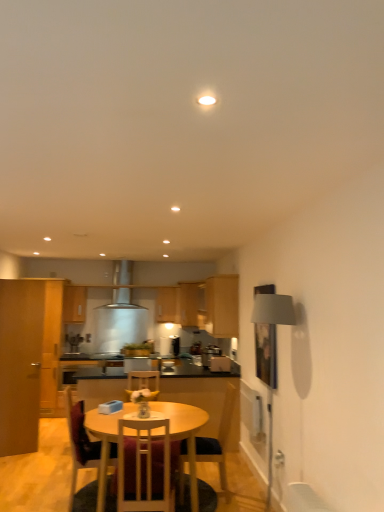
Question: From the image's perspective, is wooden chair at center, which is counted as the 2th chair, starting from the back, located above wooden round table at center?

Choices:
 (A) no
 (B) yes

Answer: (B)

Question: Does wooden chair at center, which ranks as the 3th chair in front-to-back order, lie in front of wooden round table at center?

Choices:
 (A) no
 (B) yes

Answer: (A)

Question: Is wooden chair at center, which is counted as the 2th chair, starting from the back, further to camera compared to wooden round table at center?

Choices:
 (A) yes
 (B) no

Answer: (A)

Question: Is wooden chair at center, which ranks as the 3th chair in front-to-back order, oriented away from wooden round table at center?

Choices:
 (A) no
 (B) yes

Answer: (B)

Question: Is wooden chair at center, which ranks as the 3th chair in front-to-back order, outside wooden round table at center?

Choices:
 (A) no
 (B) yes

Answer: (A)

Question: Is point (112, 416) positioned closer to the camera than point (177, 347)?

Choices:
 (A) closer
 (B) farther

Answer: (A)

Question: In terms of width, does wooden round table at center look wider or thinner when compared to satin black toaster at center, arranged as the 3th appliance when viewed from the front?

Choices:
 (A) thin
 (B) wide

Answer: (B)

Question: Based on their positions, is wooden round table at center located to the left or right of satin black toaster at center, arranged as the 3th appliance when viewed from the front?

Choices:
 (A) left
 (B) right

Answer: (A)

Question: From the image's perspective, relative to satin black toaster at center, placed as the 1th appliance when sorted from left to right, is wooden round table at center above or below?

Choices:
 (A) below
 (B) above

Answer: (A)

Question: Is matte wood cabinet at upper center, the 4th cabinetry when ordered from left to right, to the left or to the right of wooden chair at lower center, marked as the 2th chair in a front-to-back arrangement, in the image?

Choices:
 (A) left
 (B) right

Answer: (B)

Question: Would you say matte wood cabinet at upper center, which is the second cabinetry from right to left, is inside or outside wooden chair at lower center, marked as the 2th chair in a front-to-back arrangement?

Choices:
 (A) outside
 (B) inside

Answer: (A)

Question: Considering their positions, is matte wood cabinet at upper center, which is the 3th cabinetry in back-to-front order, located in front of or behind wooden chair at lower center, marked as the 2th chair in a front-to-back arrangement?

Choices:
 (A) behind
 (B) front

Answer: (A)

Question: From the image's perspective, relative to wooden chair at lower center, marked as the 2th chair in a front-to-back arrangement, is matte wood cabinet at upper center, which ranks as the 3th cabinetry in front-to-back order, above or below?

Choices:
 (A) below
 (B) above

Answer: (B)

Question: Is point (178, 352) closer or farther from the camera than point (130, 377)?

Choices:
 (A) closer
 (B) farther

Answer: (B)

Question: Is satin black toaster at center, the 1th appliance in the back-to-front sequence, taller or shorter than wooden chair at center, which ranks as the 1th chair in back-to-front order?

Choices:
 (A) tall
 (B) short

Answer: (B)